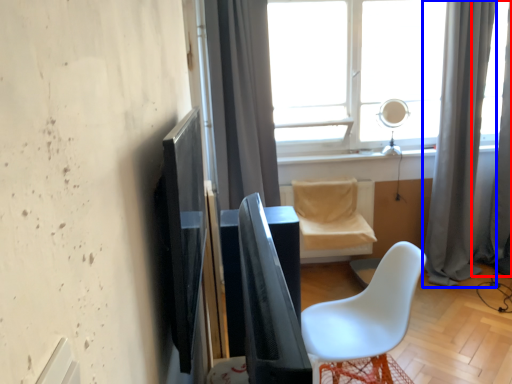
Question: Which object appears farthest to the camera in this image, curtain (highlighted by a red box) or curtain (highlighted by a blue box)?

Choices:
 (A) curtain
 (B) curtain

Answer: (A)